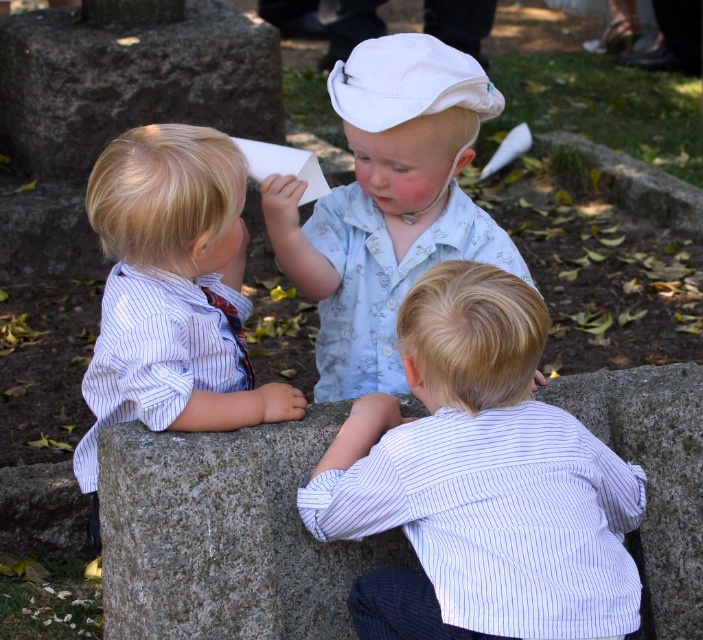
Is striped cotton shirt at left positioned behind granite stone at upper left?

No, striped cotton shirt at left is in front of granite stone at upper left.

You are a GUI agent. You are given a task and a screenshot of the screen. Output one action in this format:
    pyautogui.click(x=<x>, y=<y>)
    Task: Click on the striped cotton shirt at left
    The image size is (703, 640).
    Given the screenshot: What is the action you would take?
    pyautogui.click(x=172, y=292)

Locate an element on the screen. The height and width of the screenshot is (640, 703). striped cotton shirt at left is located at coordinates (172, 292).

The width and height of the screenshot is (703, 640). What do you see at coordinates (387, 204) in the screenshot? I see `light blue floral shirt at center` at bounding box center [387, 204].

Is light blue floral shirt at center closer to the viewer compared to striped cotton shirt at left?

No, it is behind striped cotton shirt at left.

Does point (311, 230) come behind point (264, 401)?

Yes, it is.

At what (x,y) coordinates should I click in order to perform the action: click on light blue floral shirt at center. Please return your answer as a coordinate pair (x, y). Looking at the image, I should click on (387, 204).

Is white striped shirt at center wider than granite stone at upper left?

Incorrect, white striped shirt at center's width does not surpass granite stone at upper left's.

Looking at this image, does white striped shirt at center come in front of granite stone at upper left?

Yes.

The width and height of the screenshot is (703, 640). In order to click on white striped shirt at center in this screenshot , I will do `click(479, 481)`.